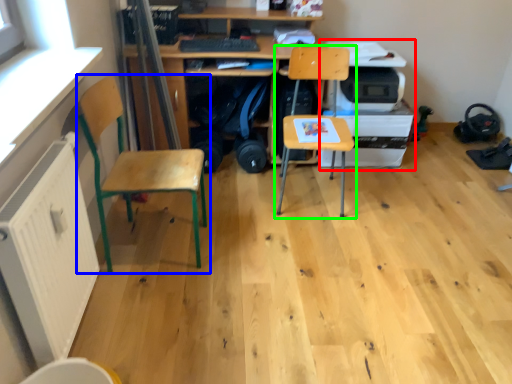
Question: Estimate the real-world distances between objects in this image. Which object is farther from printer (highlighted by a red box), chair (highlighted by a blue box) or chair (highlighted by a green box)?

Choices:
 (A) chair
 (B) chair

Answer: (A)